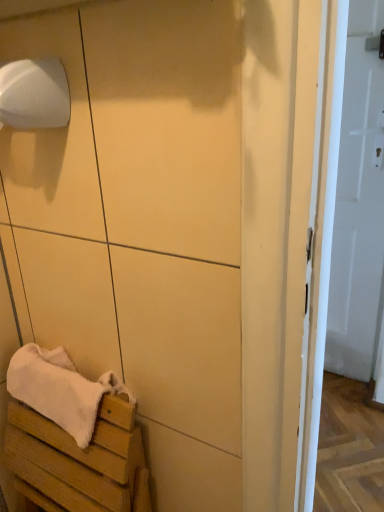
Question: Is the position of wooden crate at lower left less distant than that of white matte toilet paper at upper left?

Choices:
 (A) no
 (B) yes

Answer: (B)

Question: Can you confirm if wooden crate at lower left is positioned to the left of white matte toilet paper at upper left?

Choices:
 (A) yes
 (B) no

Answer: (B)

Question: Does wooden crate at lower left have a larger size compared to white matte toilet paper at upper left?

Choices:
 (A) yes
 (B) no

Answer: (A)

Question: From a real-world perspective, is wooden crate at lower left below white matte toilet paper at upper left?

Choices:
 (A) no
 (B) yes

Answer: (B)

Question: Can you confirm if wooden crate at lower left is positioned to the right of white matte toilet paper at upper left?

Choices:
 (A) yes
 (B) no

Answer: (A)

Question: Is wooden crate at lower left not inside white matte toilet paper at upper left?

Choices:
 (A) no
 (B) yes

Answer: (B)

Question: From a real-world perspective, is white matte toilet paper at upper left under white wood bench at lower left?

Choices:
 (A) no
 (B) yes

Answer: (A)

Question: Can you confirm if white matte toilet paper at upper left is taller than white wood bench at lower left?

Choices:
 (A) yes
 (B) no

Answer: (B)

Question: Is white matte toilet paper at upper left facing towards white wood bench at lower left?

Choices:
 (A) no
 (B) yes

Answer: (A)

Question: From the image's perspective, is white matte toilet paper at upper left beneath white wood bench at lower left?

Choices:
 (A) yes
 (B) no

Answer: (B)

Question: From the image's perspective, would you say white matte toilet paper at upper left is positioned over white wood bench at lower left?

Choices:
 (A) no
 (B) yes

Answer: (B)

Question: Considering the relative sizes of white matte toilet paper at upper left and white wood bench at lower left in the image provided, is white matte toilet paper at upper left thinner than white wood bench at lower left?

Choices:
 (A) no
 (B) yes

Answer: (B)

Question: Is white matte toilet paper at upper left smaller than white glossy door at right?

Choices:
 (A) yes
 (B) no

Answer: (A)